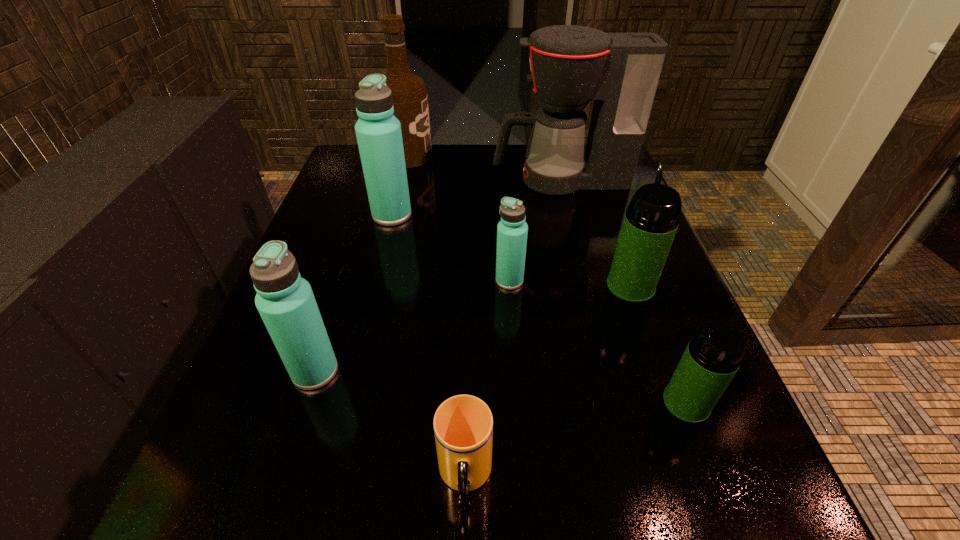
Locate which aqua thermos bottle ranks second in proximity to the second biggest aqua thermos bottle. Please provide its 2D coordinates. Your answer should be formatted as a tuple, i.e. [(x, y)], where the tuple contains the x and y coordinates of a point satisfying the conditions above.

[(378, 131)]

Identify the location of free location that satisfies the following two spatial constraints: 1. pour from the carafe of the coffee maker; 2. on the side of the fourth object from left to right with the handle. (636, 477).

This screenshot has width=960, height=540. Identify the location of blank space that satisfies the following two spatial constraints: 1. from the spout of the nearer green thermos bottle; 2. on the side of the nearest object with the handle. (715, 477).

Locate an element on the screen. free space that satisfies the following two spatial constraints: 1. on the back side of the smallest aqua thermos bottle; 2. on the label of the alcohol is located at coordinates (501, 156).

Locate an element on the screen. free region that satisfies the following two spatial constraints: 1. on the label of the alcohol; 2. on the front side of the farthest aqua thermos bottle is located at coordinates (394, 215).

Find the location of `free space that satisfies the following two spatial constraints: 1. on the label of the brown alcohol; 2. on the back side of the second nearest aqua thermos bottle`. free space that satisfies the following two spatial constraints: 1. on the label of the brown alcohol; 2. on the back side of the second nearest aqua thermos bottle is located at coordinates (377, 280).

Image resolution: width=960 pixels, height=540 pixels. What are the coordinates of `vacant space that satisfies the following two spatial constraints: 1. on the back side of the second biggest aqua thermos bottle; 2. on the right side of the third thermos bottle from left to right` in the screenshot? It's located at [345, 280].

At what (x,y) coordinates should I click in order to perform the action: click on vacant space that satisfies the following two spatial constraints: 1. from the spout of the farther green thermos bottle; 2. on the label of the alcohol. Please return your answer as a coordinate pair (x, y). Image resolution: width=960 pixels, height=540 pixels. Looking at the image, I should click on (584, 156).